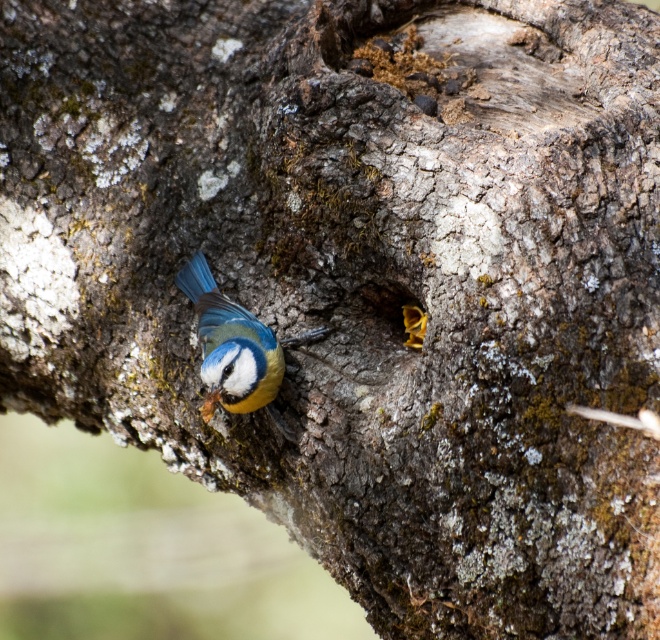
Who is shorter, blue matte bird at center or yellow wood at center?

yellow wood at center

Is blue matte bird at center below yellow wood at center?

Indeed, blue matte bird at center is positioned under yellow wood at center.

Is point (209, 362) closer to viewer compared to point (397, 321)?

Yes, point (209, 362) is in front of point (397, 321).

Identify the location of blue matte bird at center. The width and height of the screenshot is (660, 640). (236, 348).